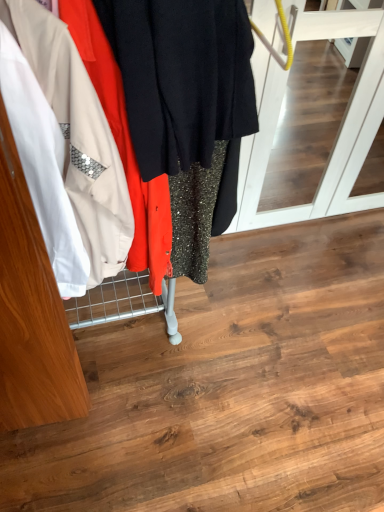
The height and width of the screenshot is (512, 384). What are the coordinates of `free space below metallic sequined dress at left (from a real-world perspective)` in the screenshot? It's located at (116, 327).